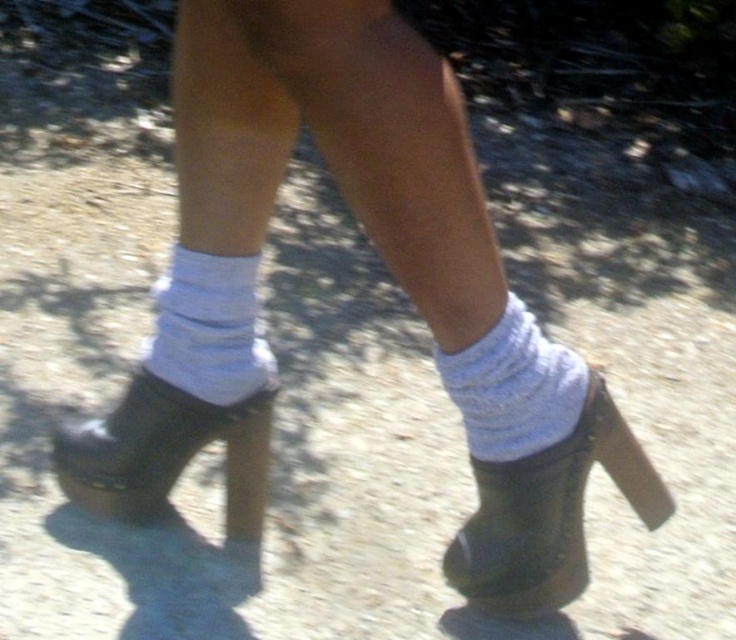
Question: Considering the relative positions of white fabric boot at center and white knitted sock at lower center in the image provided, where is white fabric boot at center located with respect to white knitted sock at lower center?

Choices:
 (A) right
 (B) left

Answer: (A)

Question: Which of these objects is positioned farthest from the white ribbed sock at center?

Choices:
 (A) white fabric boot at center
 (B) matte olive green boot at lower left
 (C) white knitted sock at lower center

Answer: (A)

Question: Among these points, which one is farthest from the camera?

Choices:
 (A) [92, 464]
 (B) [566, 394]
 (C) [545, 593]

Answer: (A)

Question: Can you confirm if matte olive green boot at lower left is positioned below white knitted sock at lower center?

Choices:
 (A) no
 (B) yes

Answer: (B)

Question: Among these objects, which one is nearest to the camera?

Choices:
 (A) white knitted sock at lower center
 (B) white ribbed sock at center
 (C) matte olive green boot at lower left
 (D) white fabric boot at center

Answer: (A)

Question: Does white fabric boot at center appear under white ribbed sock at center?

Choices:
 (A) no
 (B) yes

Answer: (B)